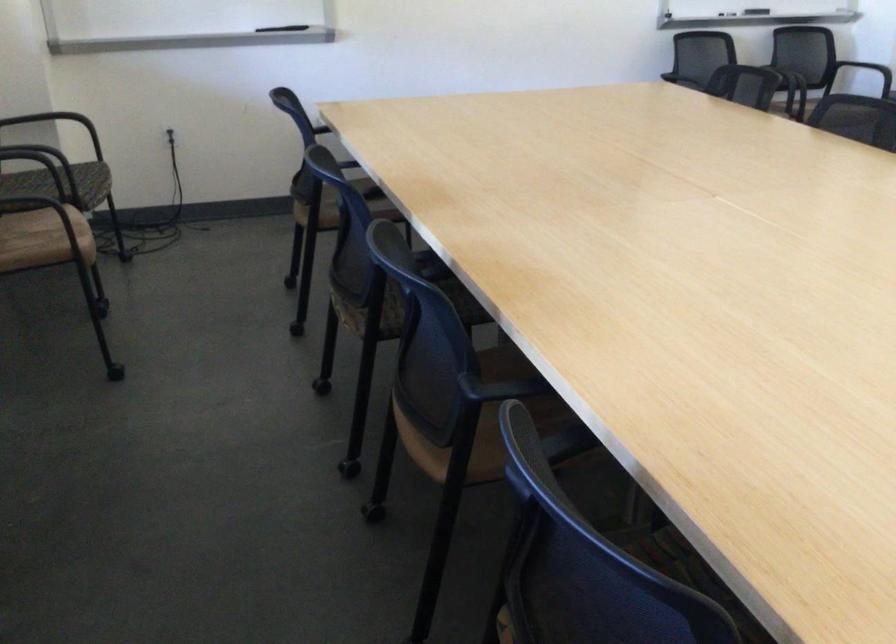
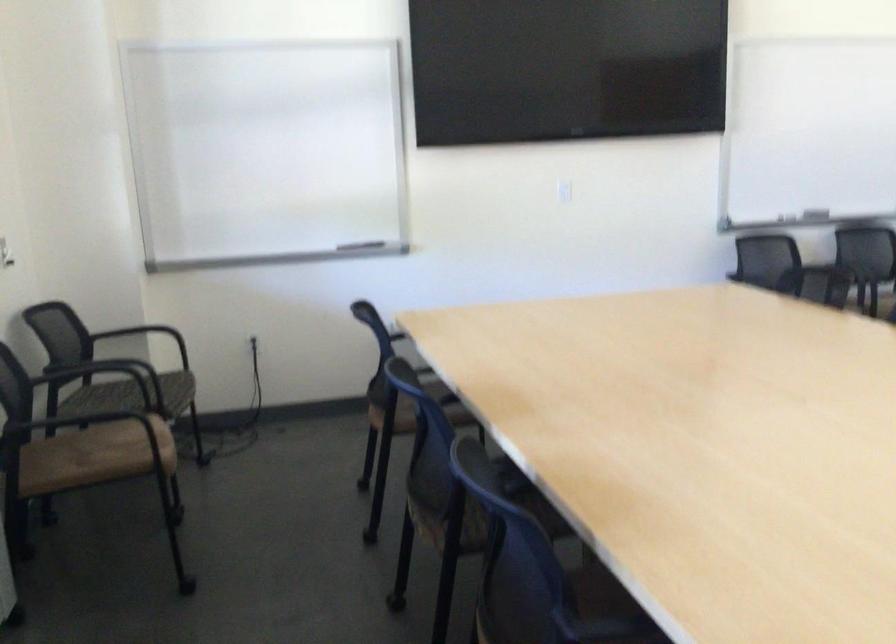
Which direction would the cameraman need to move to produce the second image?

The cameraman moved toward left, forward.